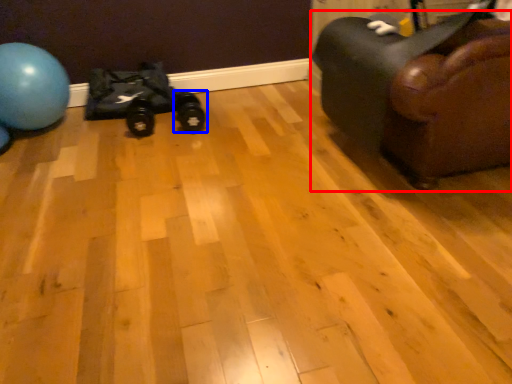
Question: Which object is further to the camera taking this photo, furniture (highlighted by a red box) or footwear (highlighted by a blue box)?

Choices:
 (A) furniture
 (B) footwear

Answer: (B)